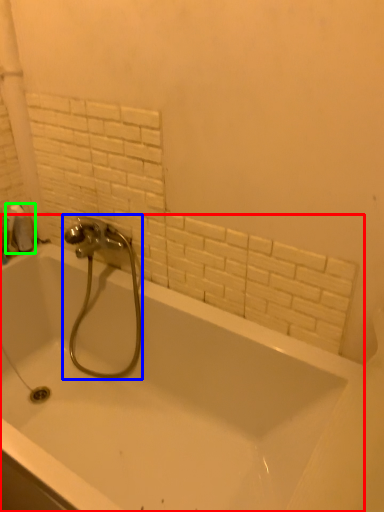
Question: Estimate the real-world distances between objects in this image. Which object is closer to bathtub (highlighted by a red box), tap (highlighted by a blue box) or toilet paper (highlighted by a green box)?

Choices:
 (A) tap
 (B) toilet paper

Answer: (A)